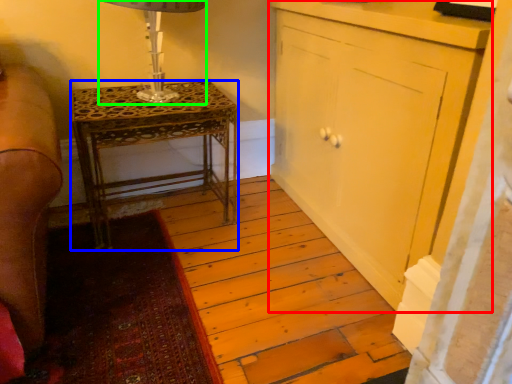
Question: Which object is positioned farthest from cabinetry (highlighted by a red box)? Select from nightstand (highlighted by a blue box) and table lamp (highlighted by a green box).

Choices:
 (A) nightstand
 (B) table lamp

Answer: (B)